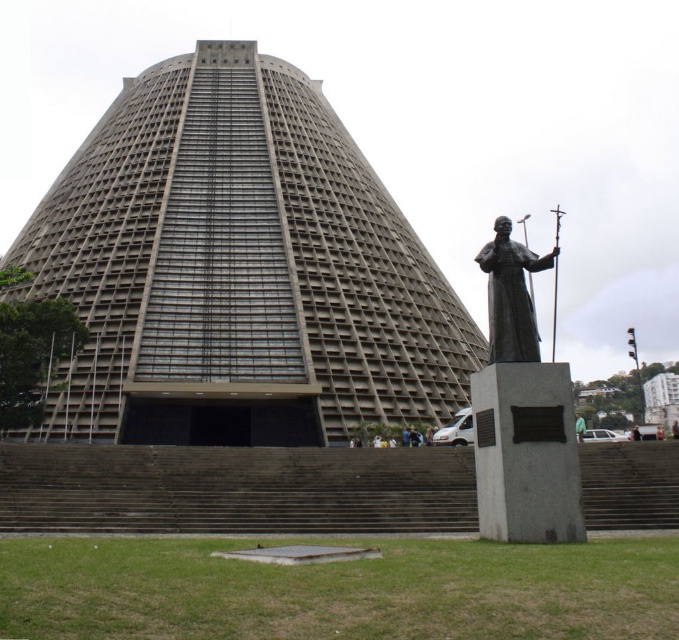
You are an art student visiting this cathedral and want to take a photo of both the polished bronze statue at lower right and the dark brown statue at center. Since you want them both in the frame, can you position yourself so that both are visible?

The polished bronze statue at lower right is located above the dark brown statue at center, so yes, you can position yourself so that both are visible in the frame.

You are an art student visiting the cathedral and notice two statues at the center. The first is a dark brown statue at center, and the second is a light brown wooden statue at center. Which one is positioned to the right?

The dark brown statue at center is positioned to the right of the light brown wooden statue at center.

You are standing at the camera position and want to take a photo of the gray concrete tower at center. If your camera can focus on objects up to 60 meters away, will you be able to capture a clear image of the tower?

The gray concrete tower at center and camera are 60.12 meters apart. Since the distance exceeds the camera maximum focus range of 60 meters, the tower will be out of focus and the image will not be clear.